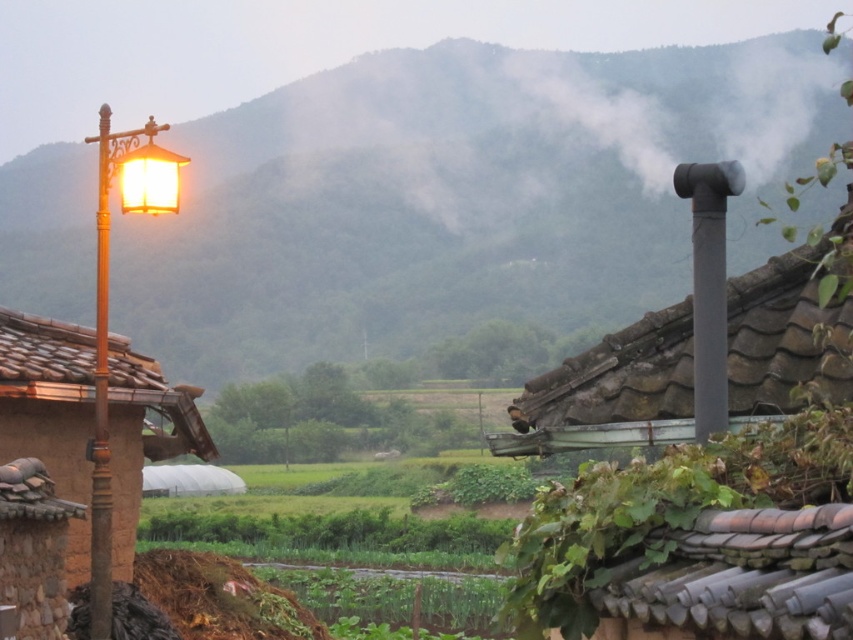
Is green leafy hillside at upper center further to camera compared to gray stone chimney at upper right?

Yes, green leafy hillside at upper center is further from the viewer.

This screenshot has height=640, width=853. I want to click on green leafy hillside at upper center, so click(x=454, y=195).

Where is `green leafy hillside at upper center`? Image resolution: width=853 pixels, height=640 pixels. green leafy hillside at upper center is located at coordinates (454, 195).

Locate an element on the screen. This screenshot has width=853, height=640. green leafy hillside at upper center is located at coordinates (454, 195).

Who is more forward, (621, 337) or (141, 385)?

Point (621, 337) is in front.

Measure the distance between gray stone chimney at upper right and camera.

The distance of gray stone chimney at upper right from camera is 7.96 meters.

The width and height of the screenshot is (853, 640). I want to click on gray stone chimney at upper right, so click(x=611, y=392).

Is point (195, 337) closer to viewer compared to point (0, 392)?

That is False.

Who is lower down, green leafy hillside at upper center or matte brown post at left?

matte brown post at left

Identify the location of green leafy hillside at upper center. (454, 195).

Identify the location of green leafy hillside at upper center. This screenshot has height=640, width=853. (454, 195).